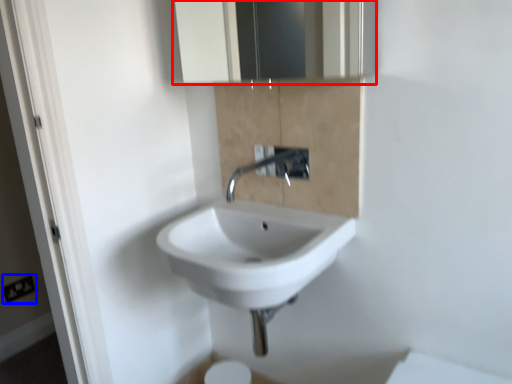
Question: Which object is further to the camera taking this photo, medicine cabinet (highlighted by a red box) or electric outlet (highlighted by a blue box)?

Choices:
 (A) medicine cabinet
 (B) electric outlet

Answer: (B)